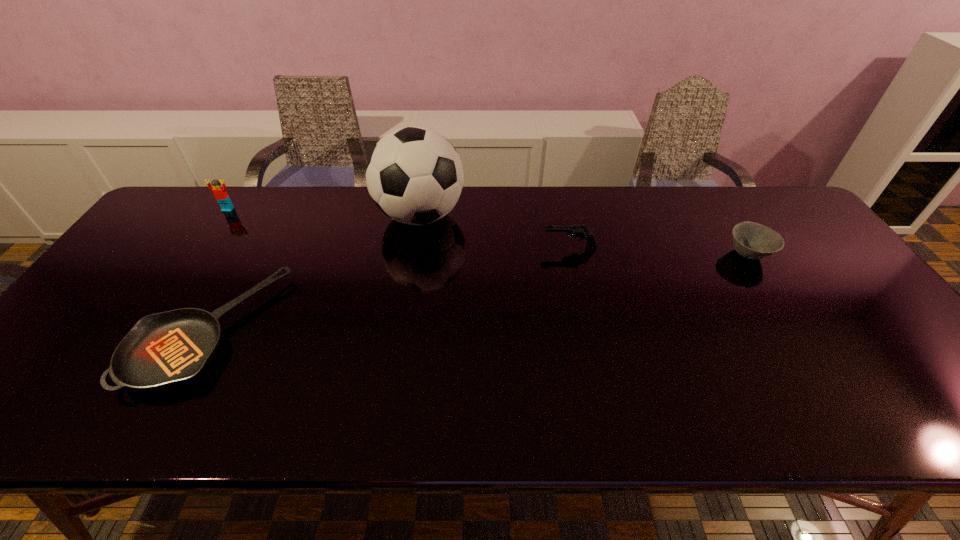
At what (x,y) coordinates should I click in order to perform the action: click on free region located on the face of the Lego. Please return your answer as a coordinate pair (x, y). Looking at the image, I should click on (201, 249).

You are a GUI agent. You are given a task and a screenshot of the screen. Output one action in this format:
    pyautogui.click(x=<x>, y=<y>)
    Task: Click on the free location located at the end of the barrel of the third shortest object
    The height and width of the screenshot is (540, 960).
    Given the screenshot: What is the action you would take?
    click(x=440, y=247)

The height and width of the screenshot is (540, 960). Find the location of `free space located 0.360m at the end of the barrel of the third shortest object`. free space located 0.360m at the end of the barrel of the third shortest object is located at coordinates (420, 247).

You are a GUI agent. You are given a task and a screenshot of the screen. Output one action in this format:
    pyautogui.click(x=<x>, y=<y>)
    Task: Click on the free location located at the end of the barrel of the third shortest object
    The image size is (960, 540).
    Given the screenshot: What is the action you would take?
    pyautogui.click(x=518, y=247)

Where is `vacant space located on the left of the rightmost object`? This screenshot has height=540, width=960. vacant space located on the left of the rightmost object is located at coordinates (620, 254).

Locate an element on the screen. This screenshot has height=540, width=960. vacant region located 0.260m on the right of the shortest object is located at coordinates (380, 330).

This screenshot has height=540, width=960. Identify the location of soccer ball that is at the far edge. (414, 175).

This screenshot has width=960, height=540. In order to click on Lego at the far edge in this screenshot , I will do `click(221, 195)`.

Where is `object that is at the near edge`? This screenshot has height=540, width=960. object that is at the near edge is located at coordinates (161, 350).

In the image, there is a desktop. Identify the location of free space at the far edge. The height and width of the screenshot is (540, 960). (709, 191).